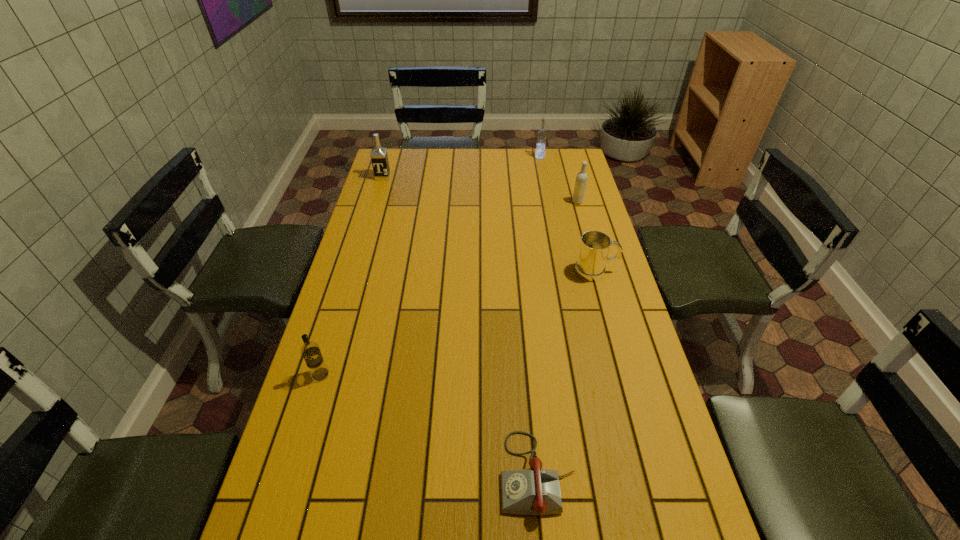
Find the location of a particular element. the second farthest object is located at coordinates (379, 157).

Where is `the third vodka from left to right`? The height and width of the screenshot is (540, 960). the third vodka from left to right is located at coordinates (542, 134).

Find the location of a particular element. the farthest object is located at coordinates (542, 134).

The width and height of the screenshot is (960, 540). I want to click on the third farthest object, so click(x=581, y=179).

Locate an element on the screen. This screenshot has width=960, height=540. the rightmost vodka is located at coordinates (581, 179).

Where is `the nearest vodka`? the nearest vodka is located at coordinates (310, 351).

Locate an element on the screen. the fourth farthest object is located at coordinates (590, 266).

You are a GUI agent. You are given a task and a screenshot of the screen. Output one action in this format:
    pyautogui.click(x=<x>, y=<y>)
    Task: Click on the mug
    The width and height of the screenshot is (960, 540).
    Given the screenshot: What is the action you would take?
    pyautogui.click(x=590, y=266)

Where is `the nearest object`? the nearest object is located at coordinates (535, 491).

I want to click on telephone, so click(x=535, y=491).